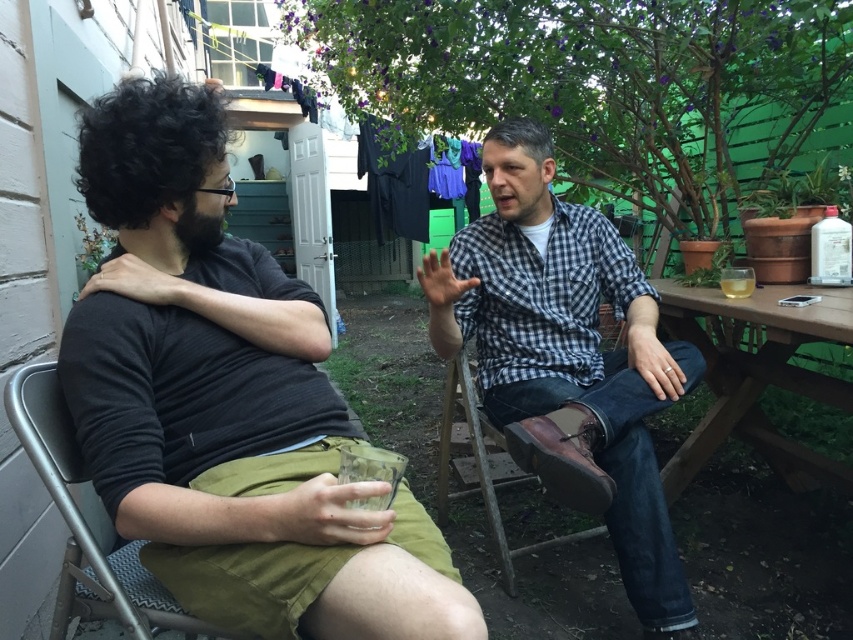
You are planning to set up a small table for two in the backyard. You have a wooden picnic table at right and a brown leather chair at center. Which object should you choose if you want a taller seating option?

The wooden picnic table at right is taller than the brown leather chair at center, so you should choose the wooden picnic table at right for a taller seating option.

You are standing in the backyard and want to place a small potted plant between the two points labeled point (677, 449) and point (560, 540). Which point should the plant be closer to in order to be closer to the viewer?

The plant should be closer to point (677, 449) because it is further to the viewer than point (560, 540).